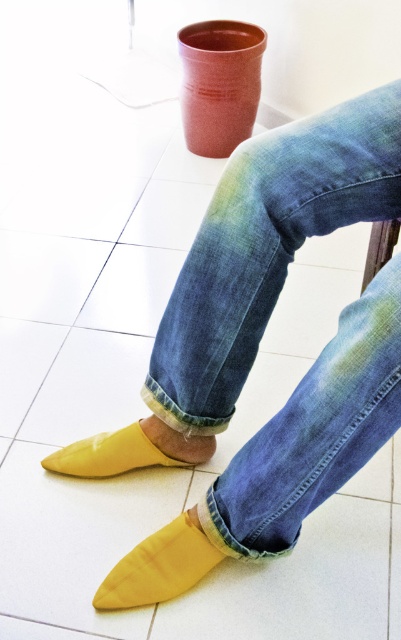
Is matte yellow slipper at lower left closer to the viewer compared to yellow rubber slipper at lower left?

Yes, it is in front of yellow rubber slipper at lower left.

Is matte yellow slipper at lower left taller than yellow rubber slipper at lower left?

Indeed, matte yellow slipper at lower left has a greater height compared to yellow rubber slipper at lower left.

The width and height of the screenshot is (401, 640). Describe the element at coordinates (159, 564) in the screenshot. I see `matte yellow slipper at lower left` at that location.

What are the coordinates of `matte yellow slipper at lower left` in the screenshot? It's located at click(159, 564).

Where is `washed denim jeans at center`? This screenshot has width=401, height=640. washed denim jeans at center is located at coordinates (315, 429).

Which of these two, washed denim jeans at center or yellow rubber slipper at lower left, stands taller?

washed denim jeans at center

Between point (295, 536) and point (135, 428), which one is positioned in front?

Point (295, 536)

Where is `washed denim jeans at center`? The width and height of the screenshot is (401, 640). washed denim jeans at center is located at coordinates (315, 429).

Who is positioned more to the right, yellow fabric socks at lower left or matte yellow slipper at lower left?

Positioned to the right is yellow fabric socks at lower left.

This screenshot has height=640, width=401. Describe the element at coordinates (247, 275) in the screenshot. I see `yellow fabric socks at lower left` at that location.

This screenshot has height=640, width=401. Find the location of `yellow fabric socks at lower left`. yellow fabric socks at lower left is located at coordinates [247, 275].